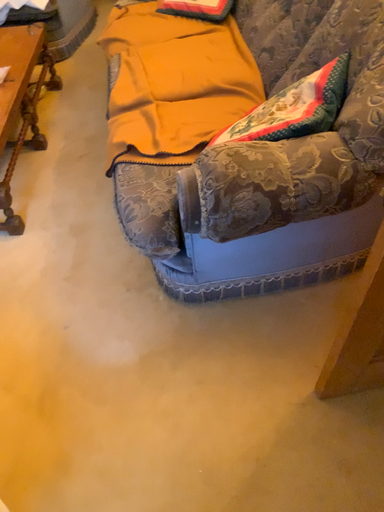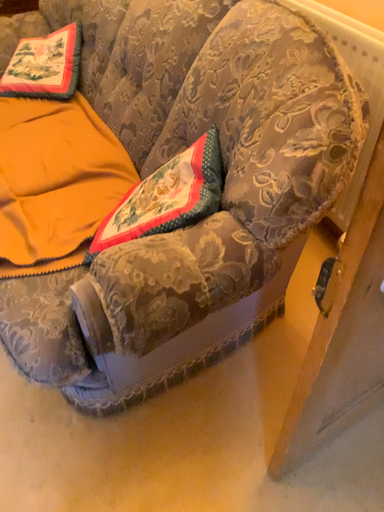
Question: Which way did the camera rotate in the video?

Choices:
 (A) rotated right
 (B) rotated left

Answer: (A)